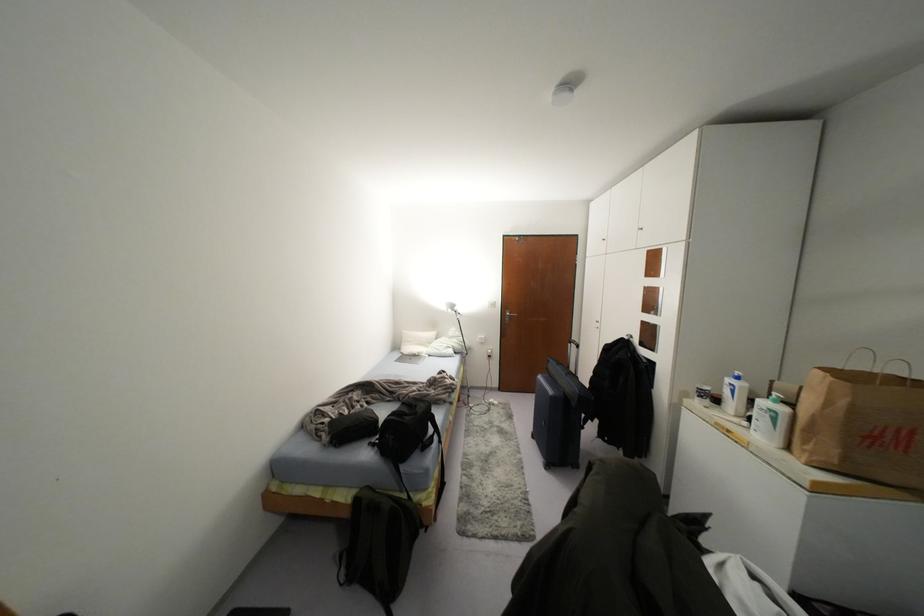
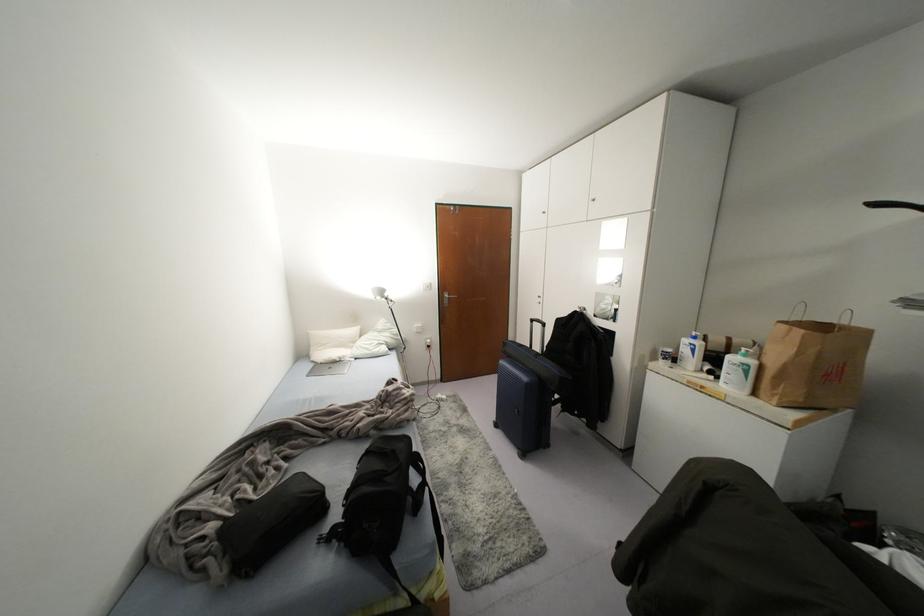
Locate, in the second image, the point that corresponds to (431,334) in the first image.

(354, 330)